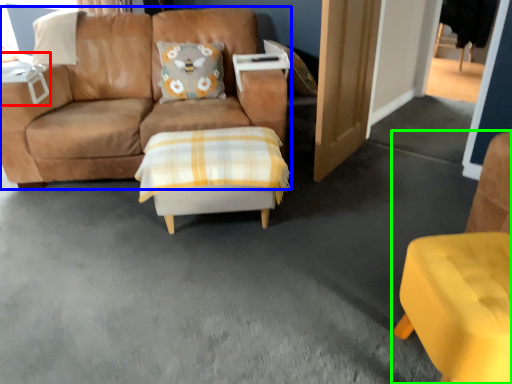
Question: Considering the real-world distances, which object is closest to table (highlighted by a red box)? studio couch (highlighted by a blue box) or chair (highlighted by a green box).

Choices:
 (A) studio couch
 (B) chair

Answer: (A)